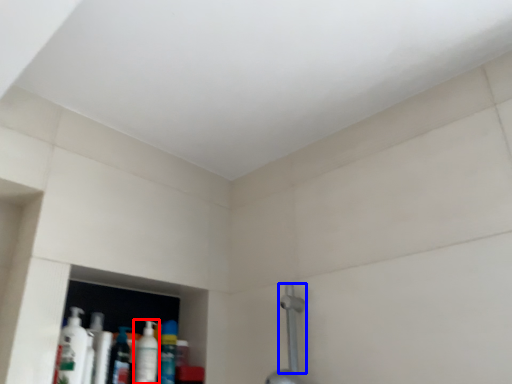
Question: Among these objects, which one is nearest to the camera, mouthwash (highlighted by a red box) or shower (highlighted by a blue box)?

Choices:
 (A) mouthwash
 (B) shower

Answer: (B)